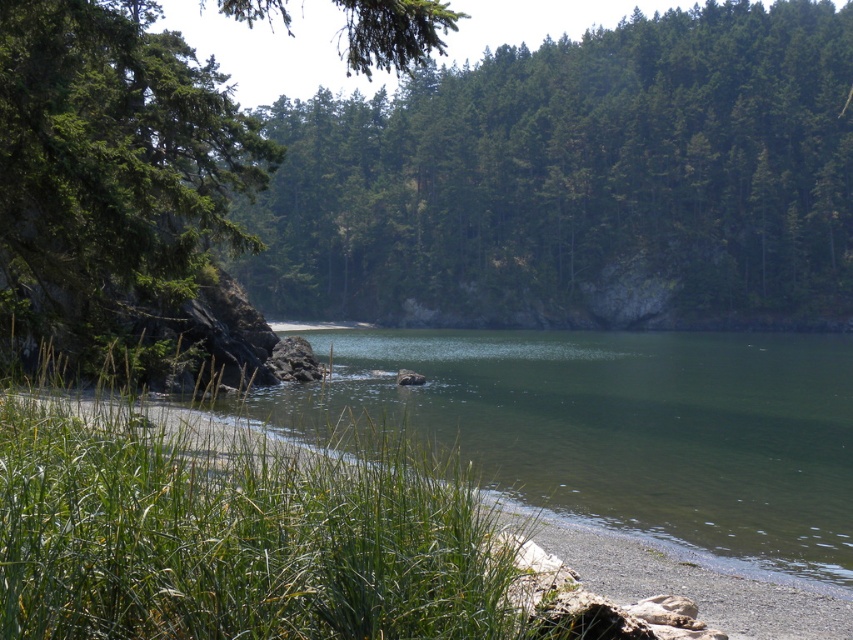
Is green textured tree at upper center to the left of green grass at lower left from the viewer's perspective?

No, green textured tree at upper center is not to the left of green grass at lower left.

The width and height of the screenshot is (853, 640). Describe the element at coordinates (578, 182) in the screenshot. I see `green textured tree at upper center` at that location.

The image size is (853, 640). Identify the location of green textured tree at upper center. (578, 182).

Between point (90, 499) and point (173, 285), which one is positioned in front?

Point (90, 499) is in front.

Does point (344, 614) come behind point (44, 83)?

No, (344, 614) is closer to viewer.

Is point (38, 516) positioned after point (200, 198)?

No, (38, 516) is closer to viewer.

The width and height of the screenshot is (853, 640). Identify the location of green grass at lower left. (305, 541).

Measure the distance from green textured tree at upper center to green matte tree at upper left.

green textured tree at upper center and green matte tree at upper left are 63.63 meters apart from each other.

Which of these two, green textured tree at upper center or green matte tree at upper left, stands taller?

With more height is green matte tree at upper left.

Is point (316, 140) less distant than point (219, 128)?

No, (316, 140) is further to viewer.

Identify the location of green textured tree at upper center. (578, 182).